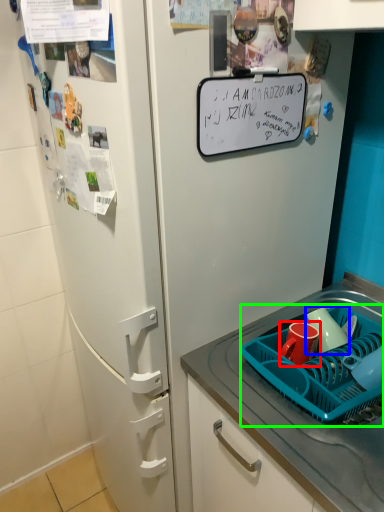
Question: Estimate the real-world distances between objects in this image. Which object is farther from coffee cup (highlighted by a red box), mug (highlighted by a blue box) or basket (highlighted by a green box)?

Choices:
 (A) mug
 (B) basket

Answer: (B)